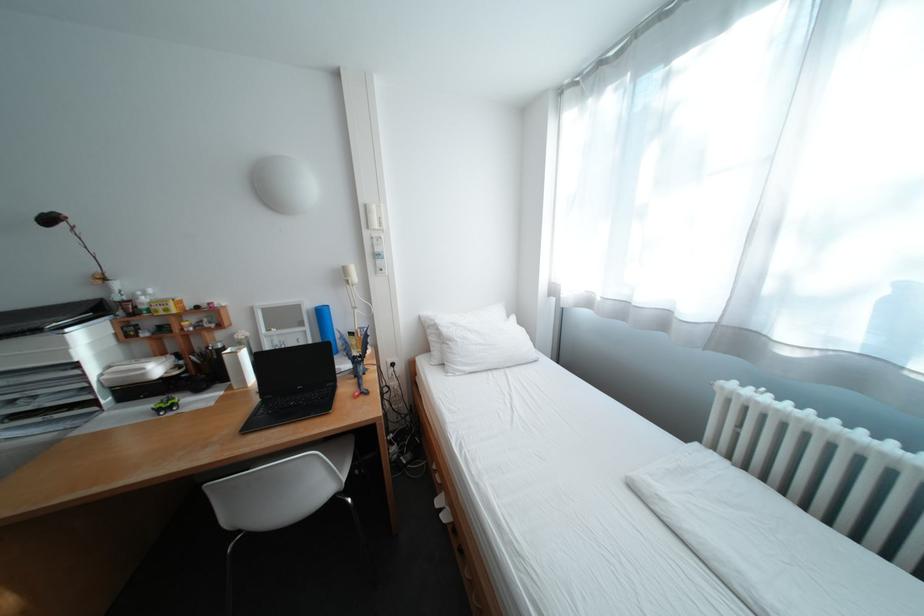
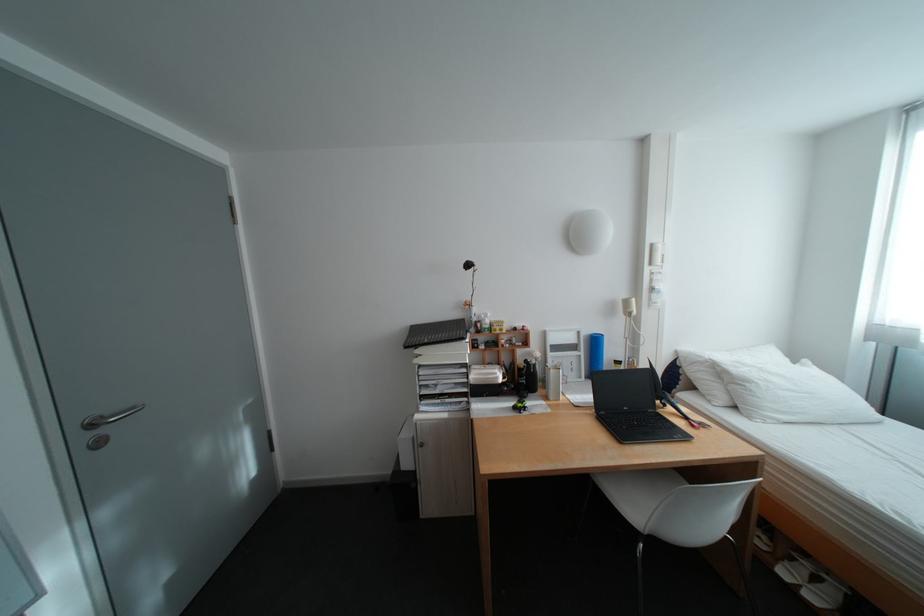
Find the pixel in the second image that matches pixel 379 207 in the first image.

(664, 246)